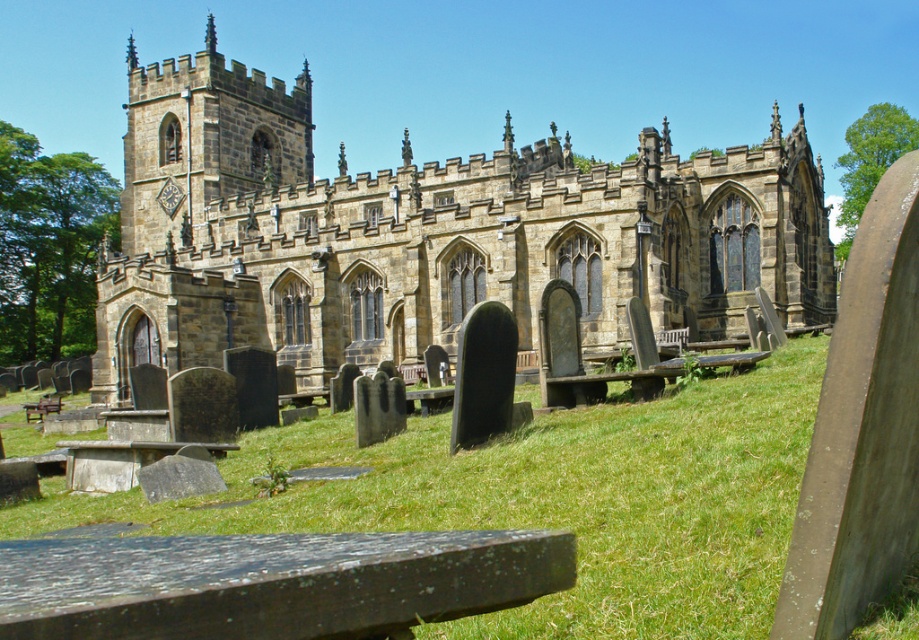
Question: Is brown stone church at center thinner than green grass at center?

Choices:
 (A) yes
 (B) no

Answer: (B)

Question: Can you confirm if brown stone church at center is thinner than green grass at center?

Choices:
 (A) no
 (B) yes

Answer: (A)

Question: Which object is farther from the camera taking this photo?

Choices:
 (A) green grass at center
 (B) brown stone church at center

Answer: (B)

Question: Can you confirm if brown stone church at center is thinner than green grass at center?

Choices:
 (A) yes
 (B) no

Answer: (B)